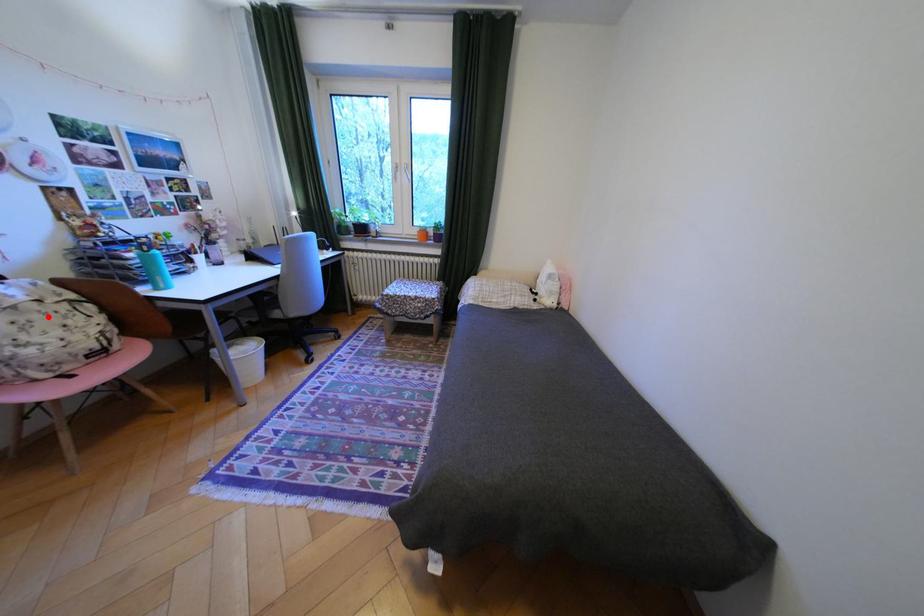
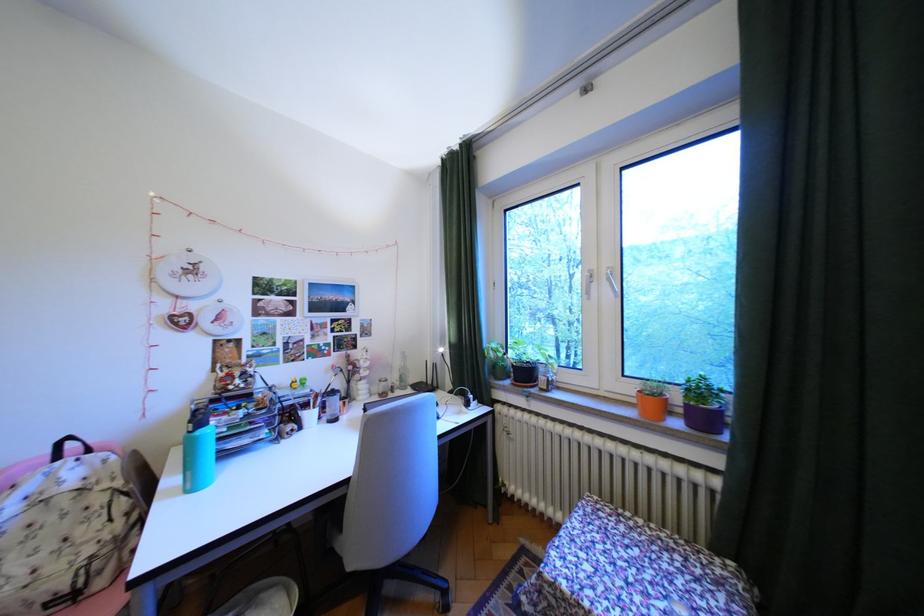
Question: I am providing you with two images of the same scene from different viewpoints. Given a red point in image1, look at the same physical point in image2. Is it:

Choices:
 (A) Closer to the viewpoint
 (B) Farther from the viewpoint

Answer: (A)